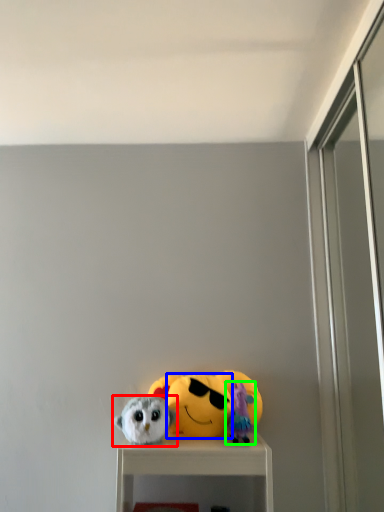
Question: Which object is the farthest from toy (highlighted by a red box)? Choose among these: face (highlighted by a blue box) or toy (highlighted by a green box).

Choices:
 (A) face
 (B) toy

Answer: (B)